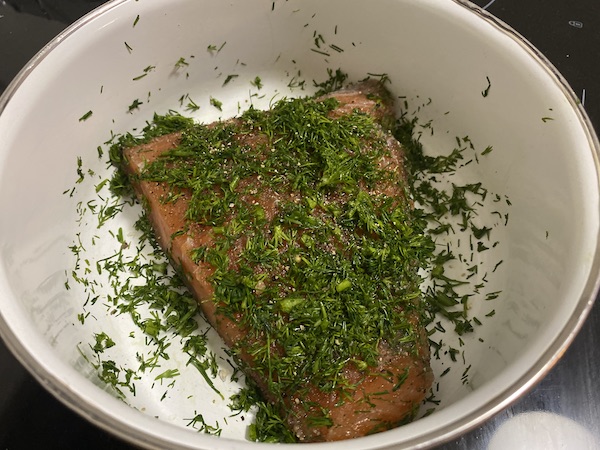
You are a GUI agent. You are given a task and a screenshot of the screen. Output one action in this format:
    pyautogui.click(x=<x>, y=<y>)
    Task: Click on the rim of plate
    The width and height of the screenshot is (600, 450).
    Given the screenshot: What is the action you would take?
    pyautogui.click(x=536, y=62)